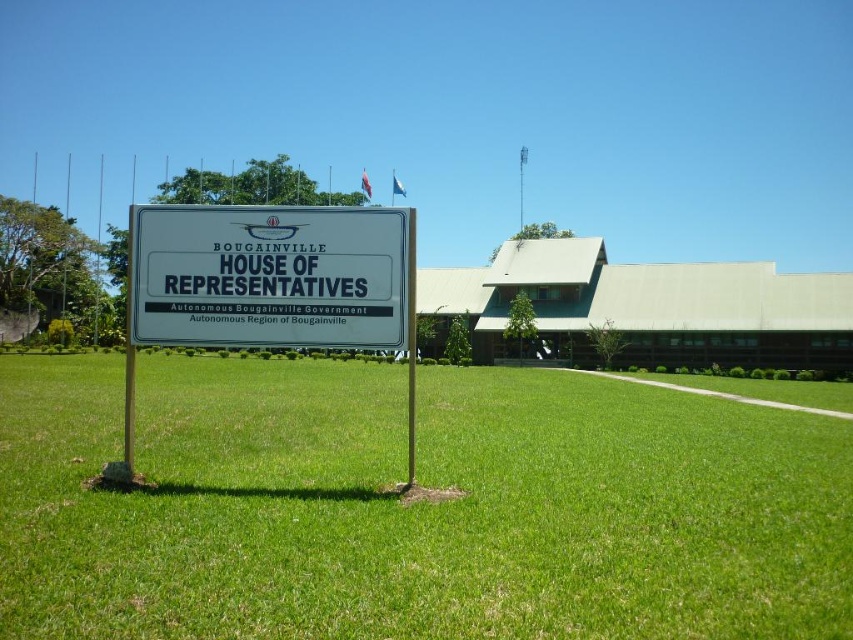
Question: Is green grass at center to the left of white plastic sign at center from the viewer's perspective?

Choices:
 (A) yes
 (B) no

Answer: (B)

Question: Can you confirm if green grass at center is thinner than white plastic sign at center?

Choices:
 (A) yes
 (B) no

Answer: (B)

Question: Does green grass at center appear over white plastic sign at center?

Choices:
 (A) yes
 (B) no

Answer: (B)

Question: Among these objects, which one is farthest from the camera?

Choices:
 (A) green grass at center
 (B) white plastic sign at center

Answer: (B)